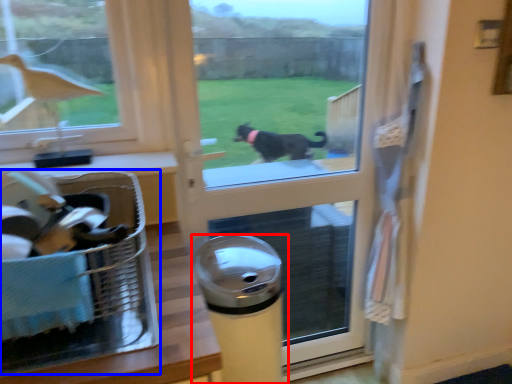
Question: Which object appears farthest to the camera in this image, waste container (highlighted by a red box) or laundry basket (highlighted by a blue box)?

Choices:
 (A) waste container
 (B) laundry basket

Answer: (A)